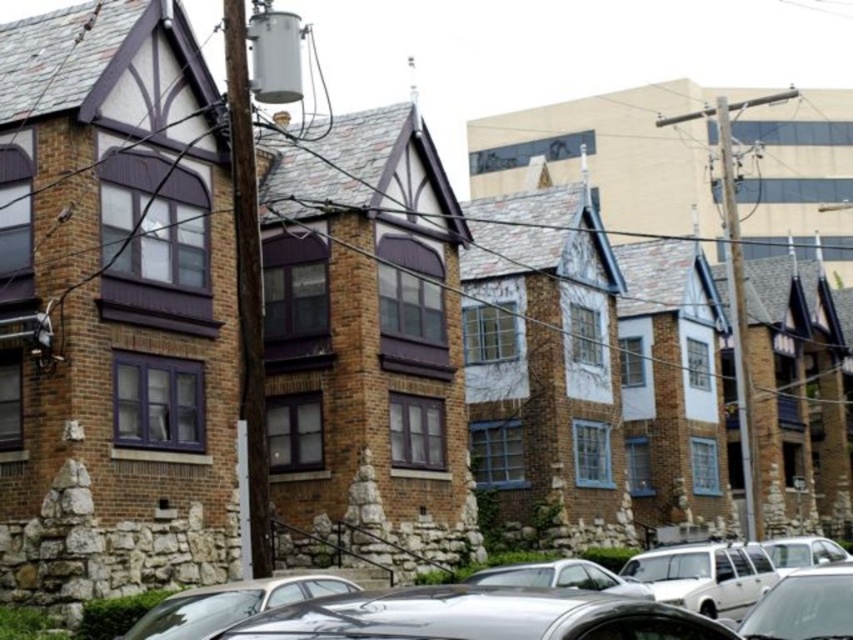
You are a delivery person trying to park your shiny silver car at lower center and shiny silver car at lower right in front of the Tudor Revival apartment buildings. Which car should you move first to avoid blocking the other?

The shiny silver car at lower center is positioned on the left side of the shiny silver car at lower right. To avoid blocking the other, you should move the shiny silver car at lower center first so that the shiny silver car at lower right can exit without obstruction.

You are a delivery driver who needs to park your truck, which is 2 meters tall, in the parking lot near the white matte station wagon at lower center and the metallic silver car at center. Can your truck fit between them if the space between them is the same as the height difference between the two cars?

The white matte station wagon at lower center is taller than the metallic silver car at center. The height difference between them is the space available. Since your truck is 2 meters tall, you need to know the exact height difference. However, the description only states that the station wagon is taller, not by how much. Without knowing the exact height difference, it is impossible to determine if the truck can fit. Please check the actual height difference before deciding.

You are standing at the point marked by point [705,576] in the image. Looking around, you see a white matte station wagon at lower center. What is the nearest object to you in this scene?

The nearest object to you is the white matte station wagon at lower center since you are standing at its marked point.